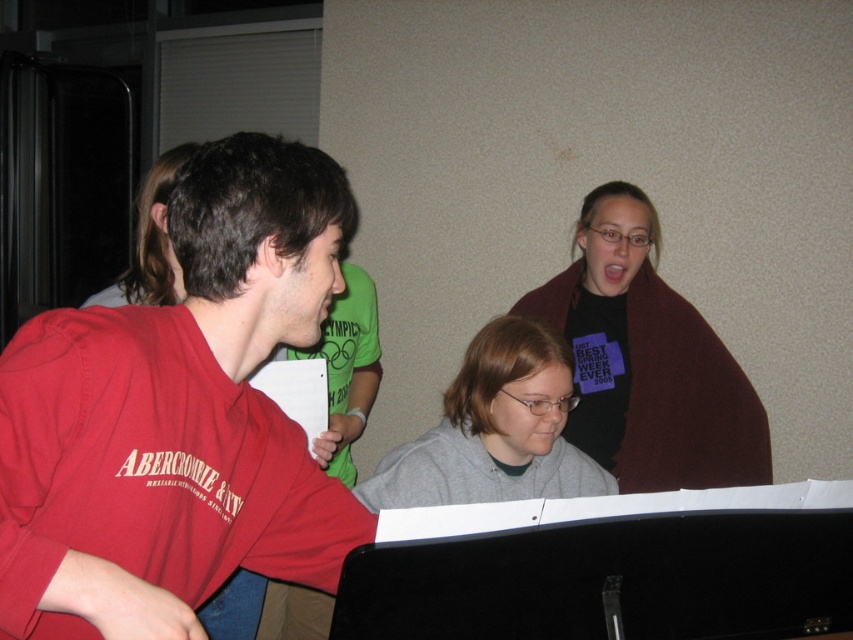
You are a photographer trying to capture a closeup of the gray matte hoodie at center without moving any objects. Since the maroon fleece blanket at upper right is in the way, can you adjust your position to take the photo?

The maroon fleece blanket at upper right is positioned over the gray matte hoodie at center, so you can move to the left side to take the photo without the blanket blocking the view.

You are standing in the room and want to take a photo of the point at coordinates point (267,284). Considering your camera has a focal length of 50mm and you want the point to be in focus, what is the minimum distance you need to be from the point to ensure it is within the camera focus range of 1 meter to infinity?

The point (267,284) is 38.22 inches away from the camera. Since 38.22 inches is approximately 0.97 meters, which is just below the minimum focus distance of 1 meter, the camera may not be able to focus on the point unless you move slightly closer to ensure the distance is within the 1 meter to infinity range.